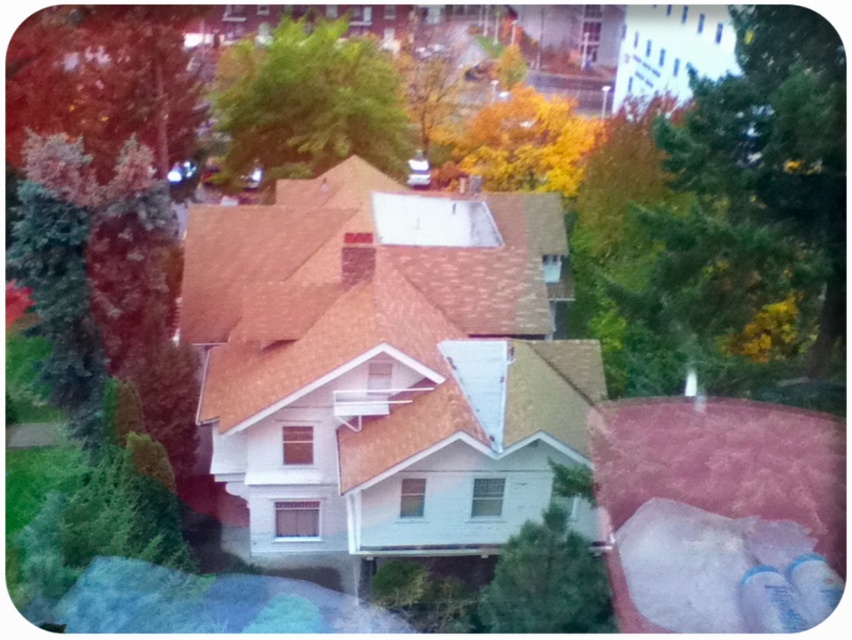
Question: Which object is closer to the camera taking this photo?

Choices:
 (A) green leafy tree at upper center
 (B) yellow autumn leaves at upper center
 (C) smooth red bark tree at upper left

Answer: (C)

Question: Which object is positioned farthest from the yellow autumn leaves at upper center?

Choices:
 (A) green leafy tree at upper center
 (B) smooth red bark tree at upper left

Answer: (B)

Question: Is green leafy tree at upper center positioned behind yellow autumn leaves at upper center?

Choices:
 (A) yes
 (B) no

Answer: (B)

Question: Estimate the real-world distances between objects in this image. Which object is farther from the yellow autumn leaves at upper center?

Choices:
 (A) green leafy tree at upper center
 (B) smooth red bark tree at upper left

Answer: (B)

Question: Is green leafy tree at upper center closer to camera compared to yellow autumn leaves at upper center?

Choices:
 (A) yes
 (B) no

Answer: (A)

Question: Is green leafy tree at upper center bigger than yellow autumn leaves at upper center?

Choices:
 (A) yes
 (B) no

Answer: (B)